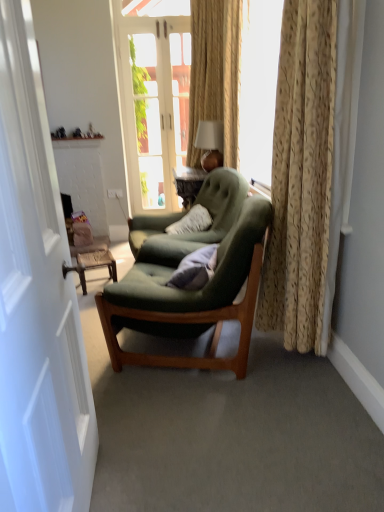
Question: Is white painted wood door at center, which ranks as the 2th door in top-to-bottom order, in front of or behind velvet blue pillow at center in the image?

Choices:
 (A) front
 (B) behind

Answer: (A)

Question: Is point (1, 430) positioned closer to the camera than point (215, 247)?

Choices:
 (A) closer
 (B) farther

Answer: (A)

Question: Which object is positioned farthest from the gold textured curtain at right?

Choices:
 (A) white glass door at center, the first door viewed from the top
 (B) velvet blue pillow at center
 (C) green fabric chair at center, acting as the first chair starting from the front
 (D) matte wood side table at lower left
 (E) matte white table lamp at upper center

Answer: (A)

Question: Considering the real-world distances, which object is closest to the velvet blue pillow at center?

Choices:
 (A) green fabric chair at center, placed as the 1th chair when sorted from back to front
 (B) gold textured curtain at right
 (C) white painted wood door at center, which ranks as the 2th door in top-to-bottom order
 (D) white glass door at center, which is the second door in front-to-back order
 (E) matte wood side table at lower left

Answer: (B)